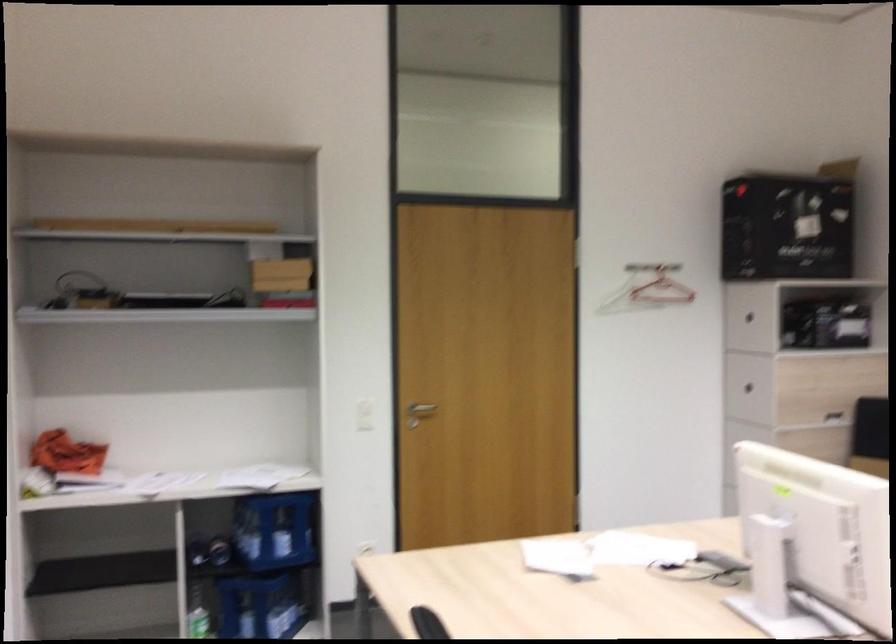
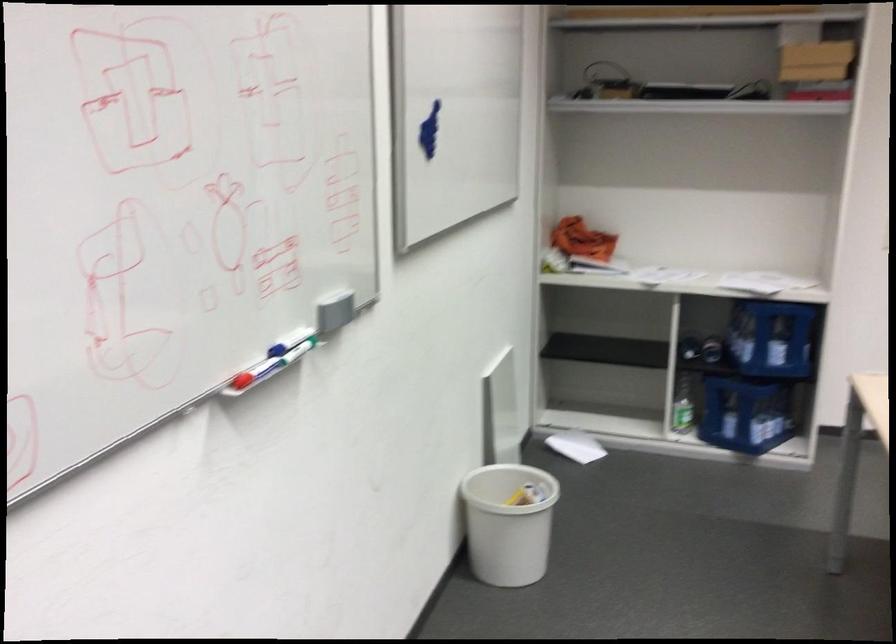
Find the pixel in the second image that matches [281,529] in the first image.

(771, 337)